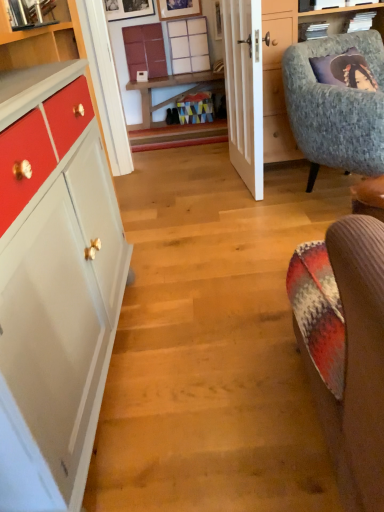
This screenshot has width=384, height=512. In order to click on empty space that is ontop of white grid shelf at upper center (from a real-world perspective) in this screenshot , I will do `click(193, 13)`.